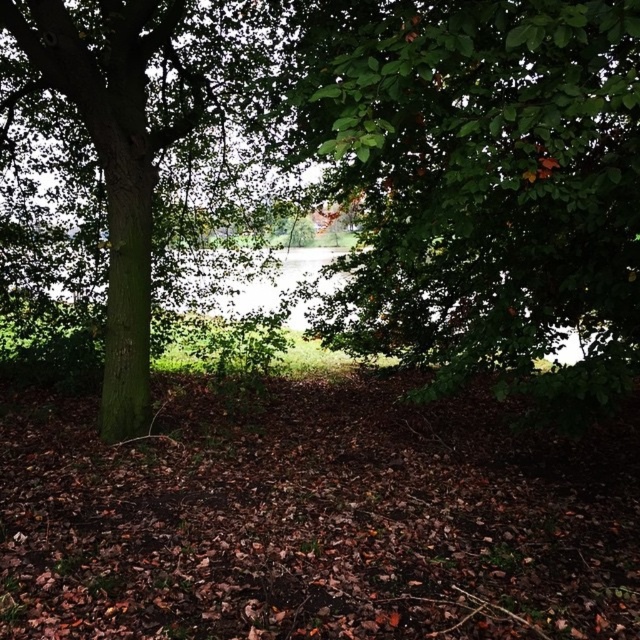
Who is lower down, green leafy tree at center or green rough bark tree at left?

Positioned lower is green leafy tree at center.

Does green leafy tree at center have a greater height compared to green rough bark tree at left?

Incorrect, green leafy tree at center's height is not larger of green rough bark tree at left's.

Where is `green leafy tree at center`? The height and width of the screenshot is (640, 640). green leafy tree at center is located at coordinates (481, 182).

The image size is (640, 640). I want to click on green leafy tree at center, so click(481, 182).